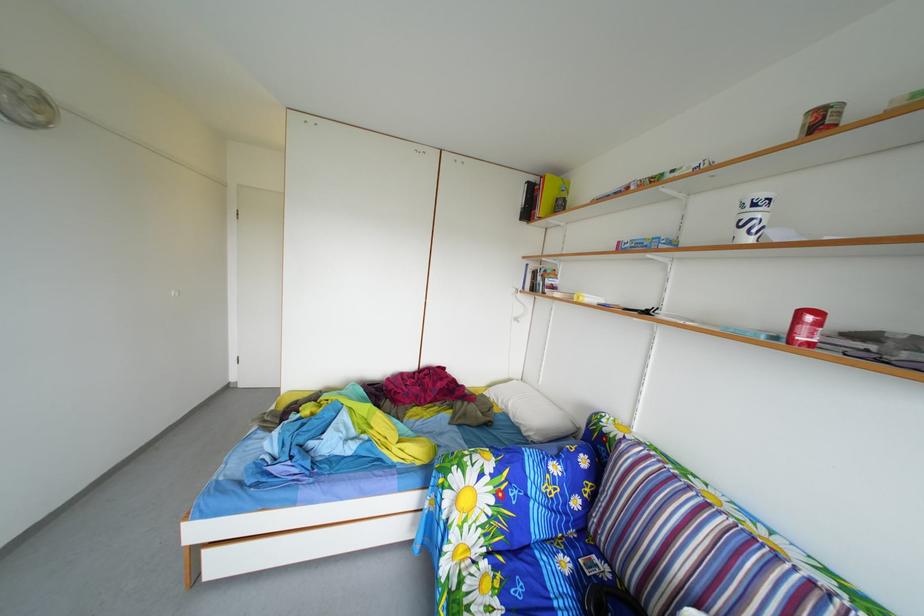
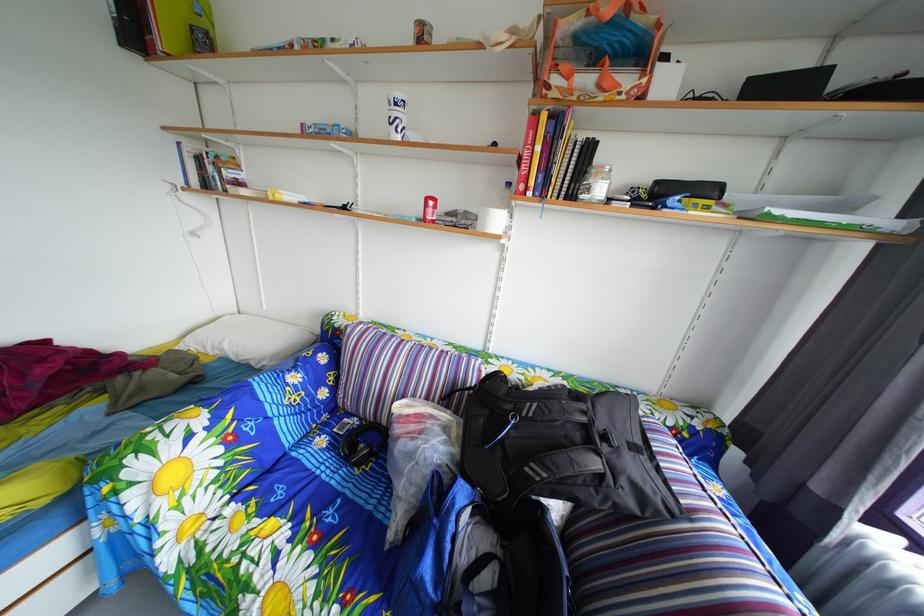
Locate, in the second image, the point that corresponds to point (759, 217) in the first image.

(404, 116)